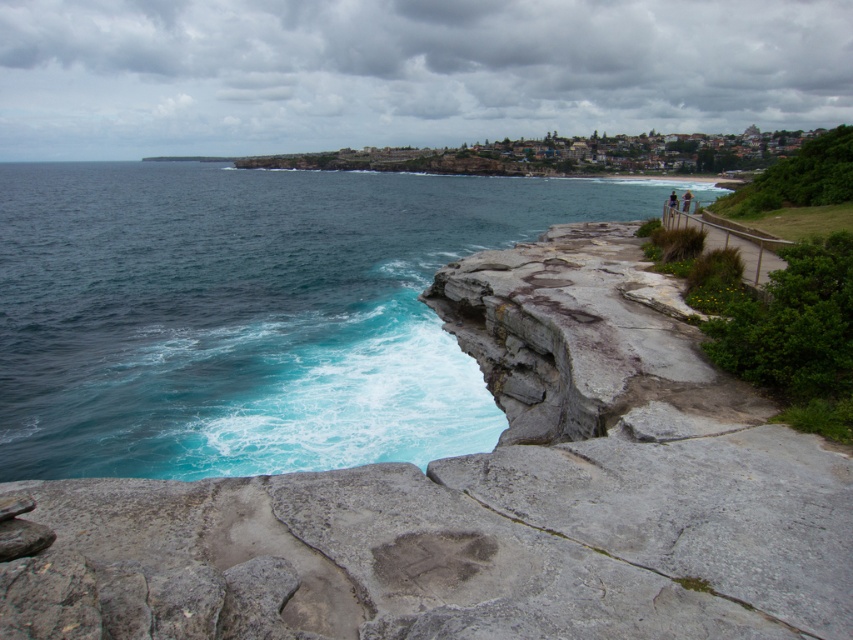
Is blue water at center taller than dark blue fabric at upper right?

Yes, blue water at center is taller than dark blue fabric at upper right.

Can you confirm if blue water at center is smaller than dark blue fabric at upper right?

Actually, blue water at center might be larger than dark blue fabric at upper right.

Between point (183, 262) and point (672, 196), which one is positioned in front?

Point (672, 196) is more forward.

This screenshot has height=640, width=853. I want to click on blue water at center, so click(x=251, y=312).

Does gray rock at center have a larger size compared to blue water at center?

Incorrect, gray rock at center is not larger than blue water at center.

Who is more forward, (x=102, y=508) or (x=323, y=220)?

Positioned in front is point (x=102, y=508).

Between point (791, 500) and point (360, 314), which one is positioned behind?

Point (360, 314)

The height and width of the screenshot is (640, 853). I want to click on gray rock at center, so click(489, 497).

The width and height of the screenshot is (853, 640). In order to click on gray rock at center in this screenshot , I will do click(x=489, y=497).

Is gray rock at center wider than light brown wooden post at upper right?

In fact, gray rock at center might be narrower than light brown wooden post at upper right.

Is point (801, 589) positioned in front of point (689, 202)?

Yes, it is.

The height and width of the screenshot is (640, 853). In order to click on gray rock at center in this screenshot , I will do `click(489, 497)`.